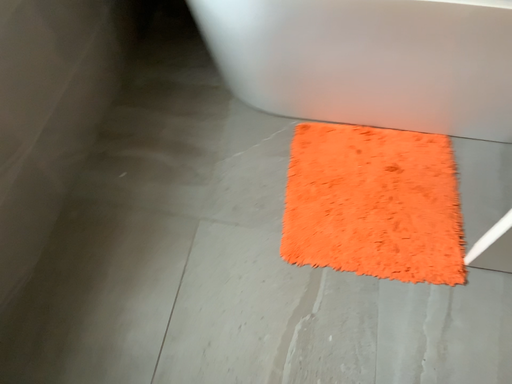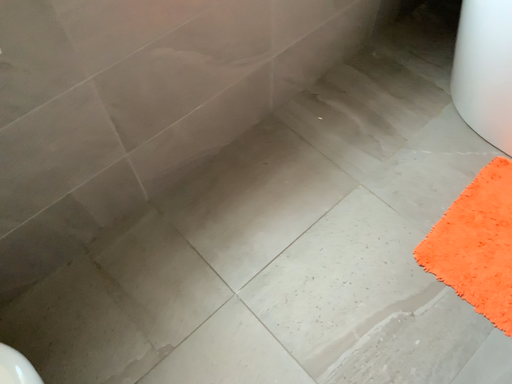
Question: How did the camera likely rotate when shooting the video?

Choices:
 (A) rotated left
 (B) rotated right

Answer: (A)